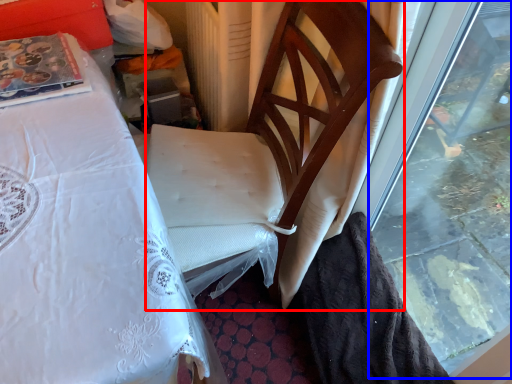
Question: Which object appears closest to the camera in this image, chair (highlighted by a red box) or window (highlighted by a blue box)?

Choices:
 (A) chair
 (B) window

Answer: (B)